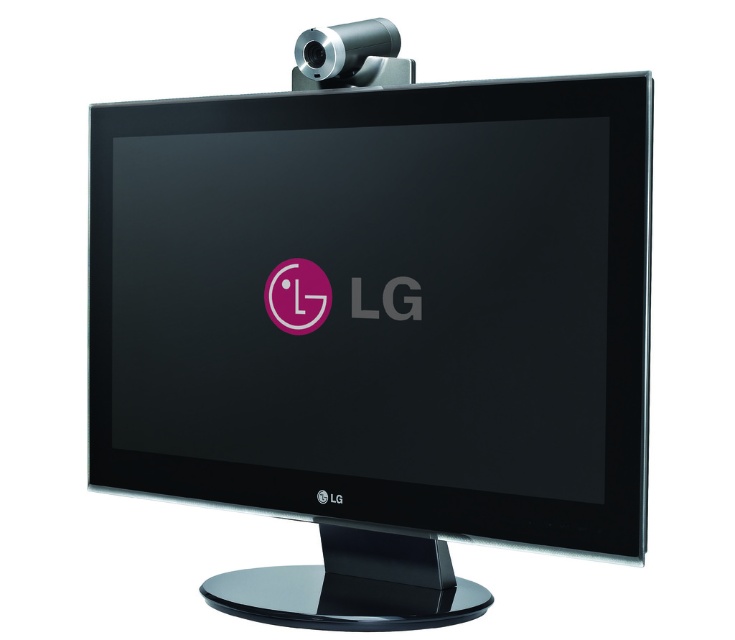
Can you confirm if black glossy monitor at center is positioned to the left of silver metallic webcam at top?

Yes, black glossy monitor at center is to the left of silver metallic webcam at top.

Does point (487, 339) lie behind point (298, 74)?

No, it is not.

Who is more forward, (491, 305) or (311, 29)?

Point (491, 305) is more forward.

This screenshot has width=735, height=640. What are the coordinates of `black glossy monitor at center` in the screenshot? It's located at (376, 326).